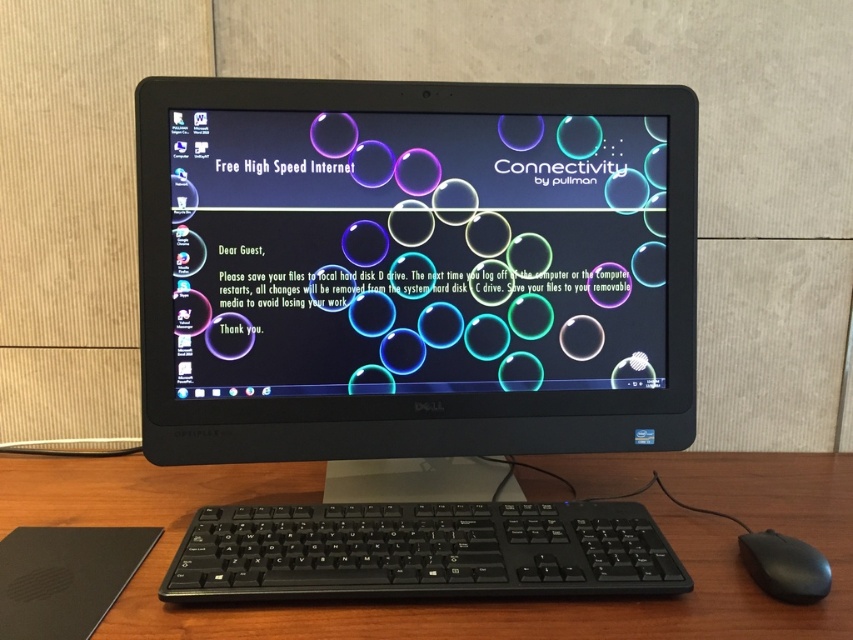
You are using the Dell OptiPlex desktop computer and need to move the cursor on the screen. Which object should you use, the black plastic keyboard at center or the black plastic mouse at lower right?

The black plastic mouse at lower right should be used to move the cursor on the screen.

You are a guest at a hotel and need to access the Dell OptiPlex desktop computer setup on the wooden desk. The point labeled point (247, 577) is where you need to place your hand to start the system. Can you reach it without moving your chair?

The point labeled point (247, 577) is 25.02 inches away from you, so yes, you can reach it without moving your chair since the average human arm length is about 25 inches.